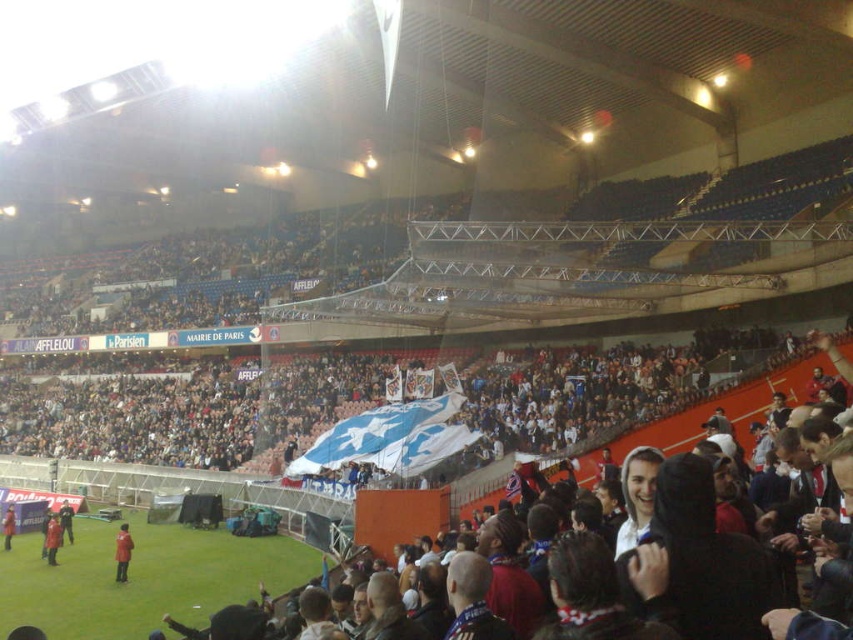
You are a photographer at the stadium and want to capture both the red matte jacket at lower left and the red jacket at lower left in a single shot. Which jacket should you focus on if you want to ensure the smaller one is clearly visible?

The red matte jacket at lower left is smaller than the red jacket at lower left. To ensure the smaller one is clearly visible, focus on the red matte jacket at lower left.

You are a drone operator trying to capture aerial footage of the stadium. Your drone is currently hovering at an altitude of 200 feet above the ground. You notice the red fabric jacket at lower left in the image. Is the drone above or below this object?

The red fabric jacket at lower left is 181.11 feet away from the viewer. Since the drone is hovering at 200 feet altitude, it is higher than the jacket, so the drone is above the red fabric jacket at lower left.